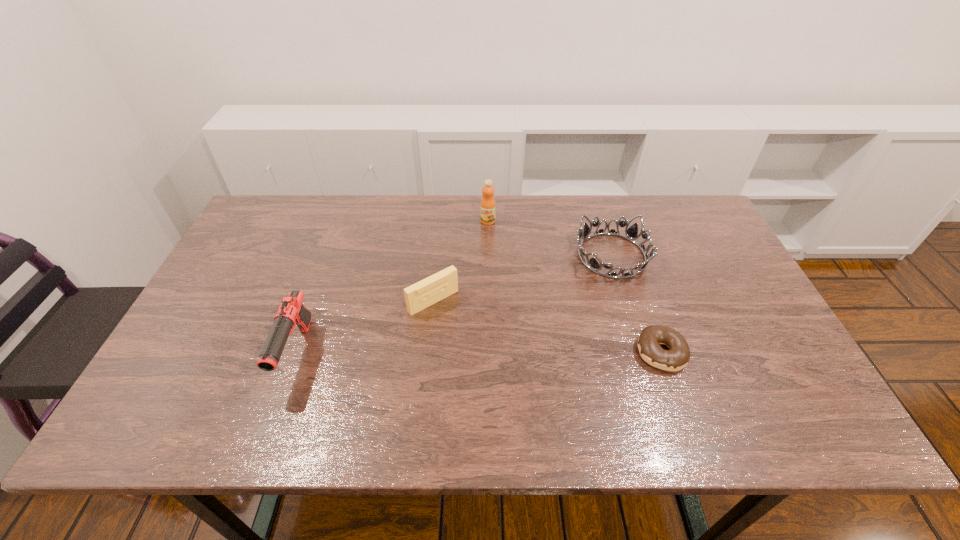
You are a GUI agent. You are given a task and a screenshot of the screen. Output one action in this format:
    pyautogui.click(x=<x>, y=<y>)
    Task: Click on the vacant space on the desktop that is between the leftmost object and the doughnut and is positioned on the front label of the third object from left to right
    
    Given the screenshot: What is the action you would take?
    pyautogui.click(x=433, y=353)

Locate an element on the screen. The image size is (960, 540). free space on the desktop that is between the leftmost object and the doughnut and is positioned on the front-facing side of the tiara is located at coordinates (496, 353).

Find the location of `vacant space on the desktop that is between the leftmost object and the doughnut and is positioned at the front of the third nearest object with spools`. vacant space on the desktop that is between the leftmost object and the doughnut and is positioned at the front of the third nearest object with spools is located at coordinates (479, 353).